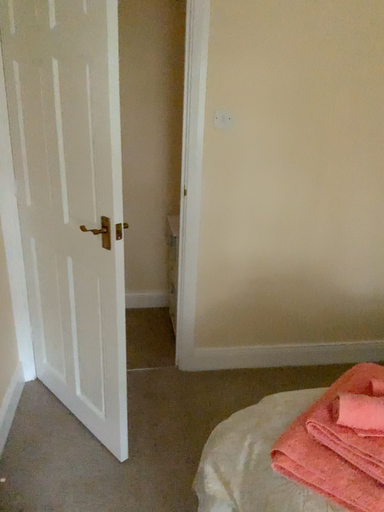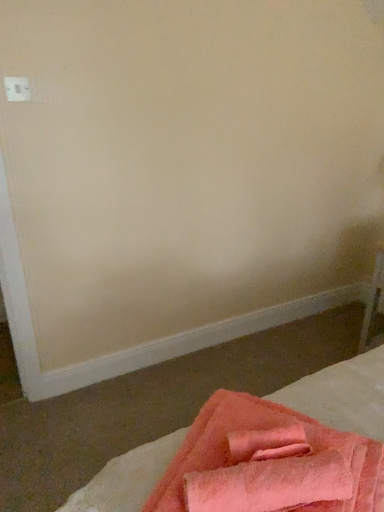
Question: Which way did the camera rotate in the video?

Choices:
 (A) rotated right
 (B) rotated left

Answer: (A)